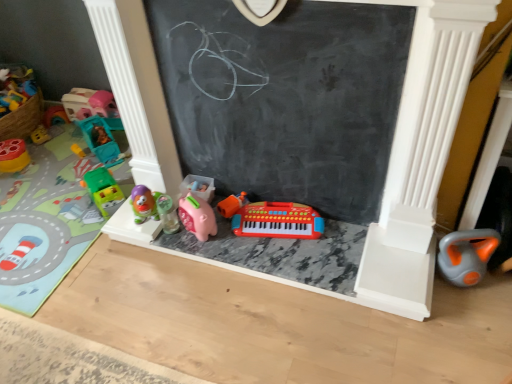
Where is `vacant space situated on the left part of translucent plastic toy car at left, positioned as the fifth toy in right-to-left order`? This screenshot has width=512, height=384. vacant space situated on the left part of translucent plastic toy car at left, positioned as the fifth toy in right-to-left order is located at coordinates 55,153.